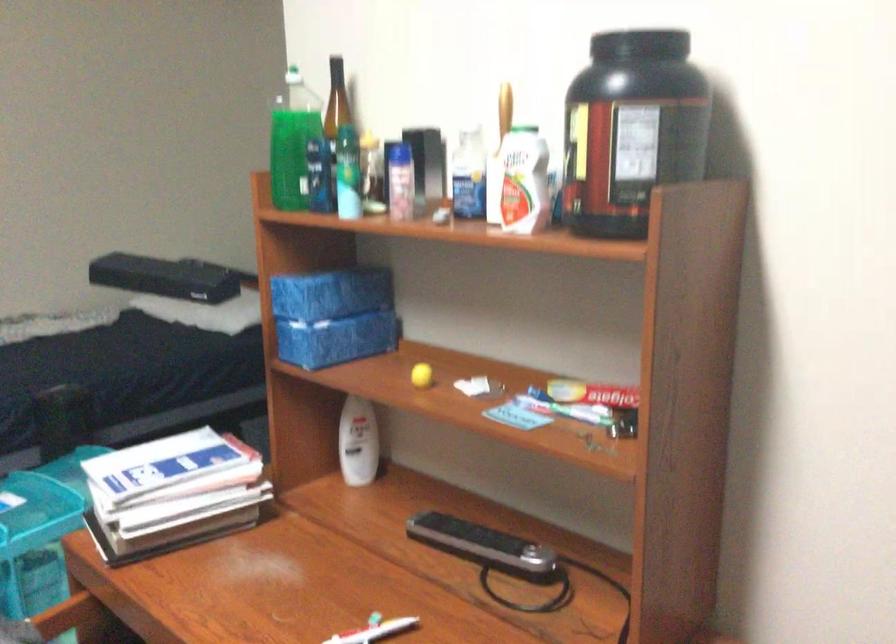
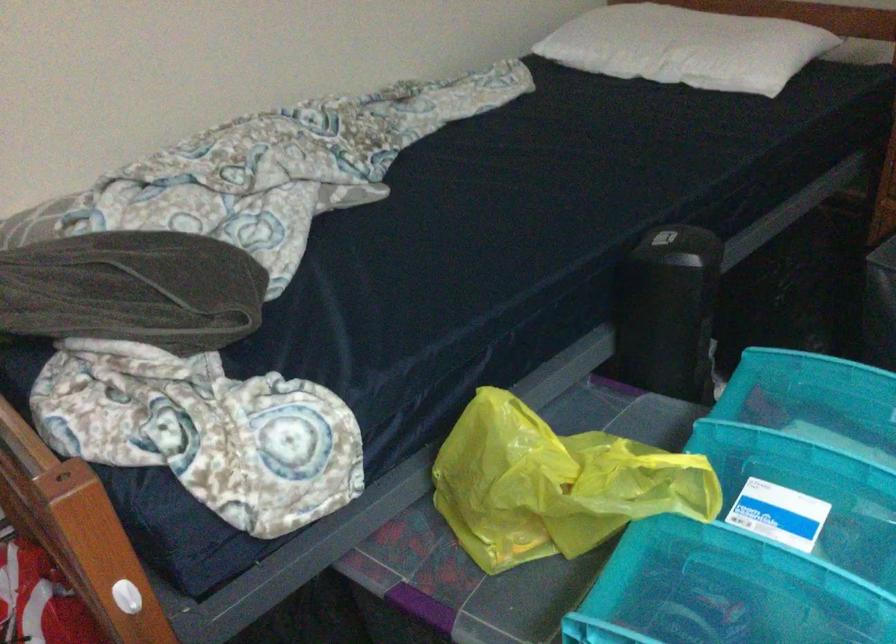
In a continuous first-person perspective shot, in which direction is the camera moving?

The cameraman moved toward left, forward.